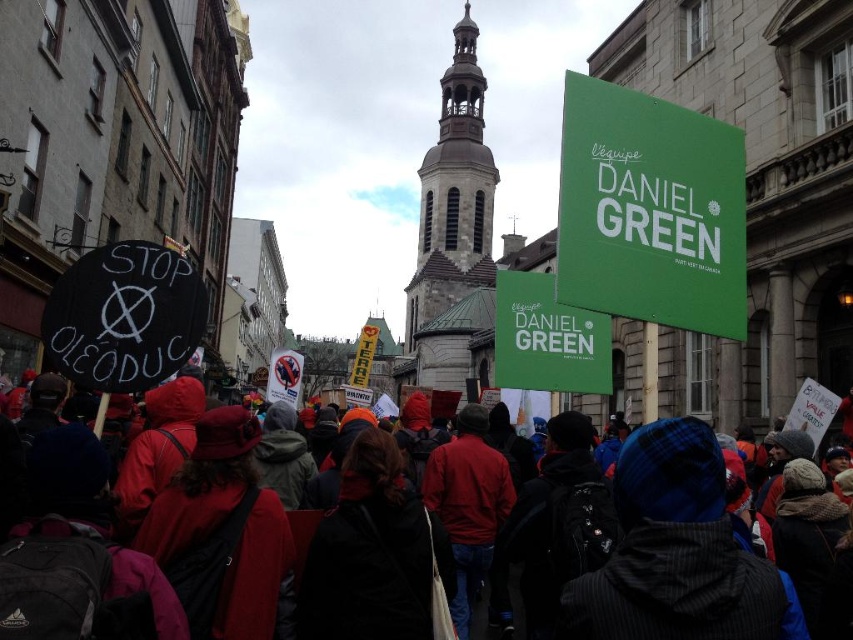
Who is shorter, red fabric crowd at center or green matte sign at upper center?

red fabric crowd at center is shorter.

Can you confirm if red fabric crowd at center is taller than green matte sign at upper center?

No.

Is point (198, 625) positioned behind point (726, 308)?

That is False.

At what (x,y) coordinates should I click in order to perform the action: click on red fabric crowd at center. Please return your answer as a coordinate pair (x, y). Image resolution: width=853 pixels, height=640 pixels. Looking at the image, I should click on (677, 552).

Measure the distance between green matte sign at upper center and camera.

They are 48.09 meters apart.

Identify the location of green matte sign at upper center. (650, 211).

Consider the image. Is red fabric crowd at center above green matte sign at upper right?

Incorrect, red fabric crowd at center is not positioned above green matte sign at upper right.

Is red fabric crowd at center to the right of green matte sign at upper right from the viewer's perspective?

Incorrect, red fabric crowd at center is not on the right side of green matte sign at upper right.

Describe the element at coordinates (677, 552) in the screenshot. I see `red fabric crowd at center` at that location.

Identify the location of red fabric crowd at center. (677, 552).